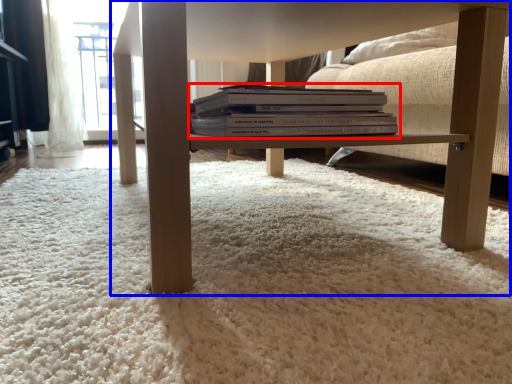
Question: Which point is closer to the camera, book (highlighted by a red box) or table (highlighted by a blue box)?

Choices:
 (A) book
 (B) table

Answer: (B)